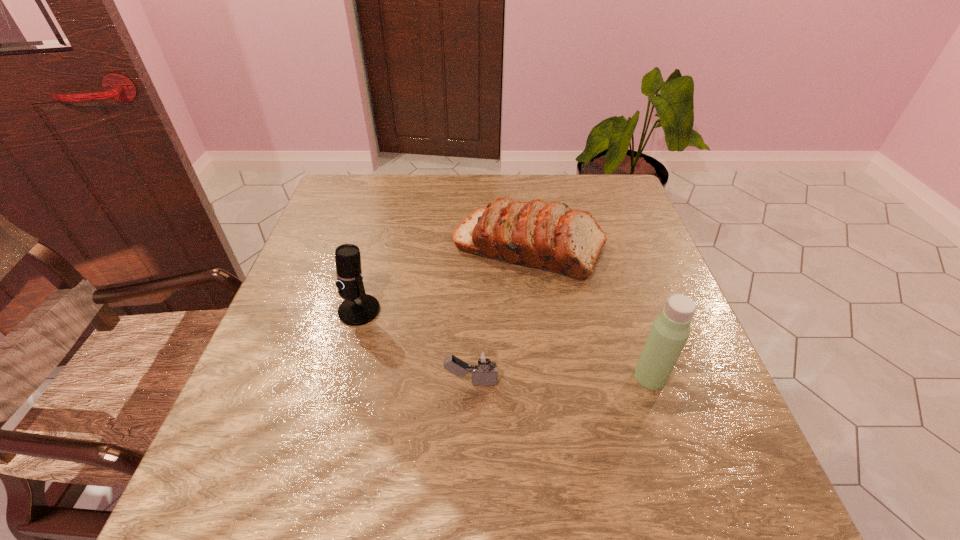
Locate an element on the screen. the tallest object is located at coordinates (670, 330).

Identify the location of microphone. This screenshot has height=540, width=960. (358, 308).

I want to click on the leftmost object, so click(x=358, y=308).

The image size is (960, 540). Identify the location of bread. (552, 237).

Locate an element on the screen. This screenshot has width=960, height=540. the shortest object is located at coordinates (484, 362).

Locate an element on the screen. Image resolution: width=960 pixels, height=540 pixels. vacant space located on the back of the tallest object is located at coordinates (623, 294).

What are the coordinates of `blank area located on the front of the leftmost object` in the screenshot? It's located at (340, 381).

You are a GUI agent. You are given a task and a screenshot of the screen. Output one action in this format:
    pyautogui.click(x=<x>, y=<y>)
    Task: Click on the vacant region located 0.200m on the left of the bread
    This screenshot has height=540, width=960.
    Given the screenshot: What is the action you would take?
    pyautogui.click(x=377, y=247)

This screenshot has width=960, height=540. I want to click on vacant region located on the left of the shortest object, so click(x=404, y=382).

Locate an element on the screen. object that is positioned at the far edge is located at coordinates (552, 237).